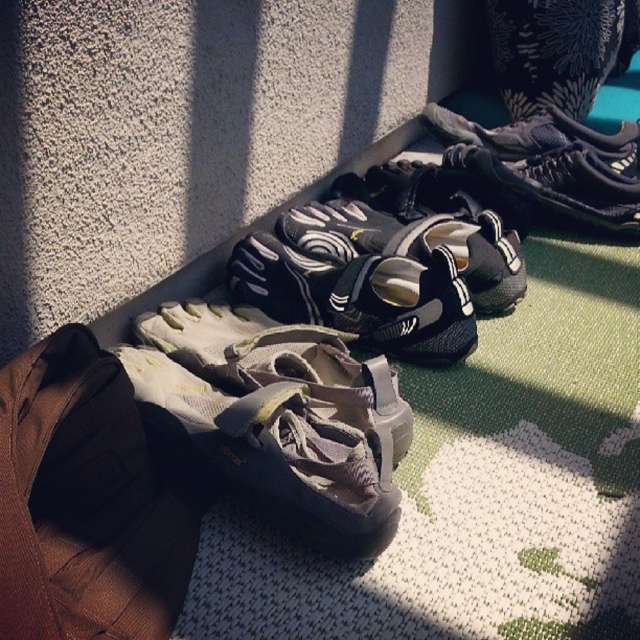
Which is more to the right, gray suede sandal at center or gray fabric sandal at center?

gray fabric sandal at center

Is point (362, 534) positioned in front of point (218, 333)?

Yes, point (362, 534) is closer to viewer.

Locate an element on the screen. The image size is (640, 640). gray suede sandal at center is located at coordinates (276, 451).

Is gray fabric sandal at center thinner than black mesh shoe at center?

Yes, gray fabric sandal at center is thinner than black mesh shoe at center.

Locate an element on the screen. The image size is (640, 640). gray fabric sandal at center is located at coordinates point(280,362).

Between gray fabric sandal at center and black mesh sneaker at upper right, which one is positioned lower?

Positioned lower is gray fabric sandal at center.

From the picture: Measure the distance between point (228, 364) and camera.

Point (228, 364) is 3.58 feet away from camera.

I want to click on gray fabric sandal at center, so click(x=280, y=362).